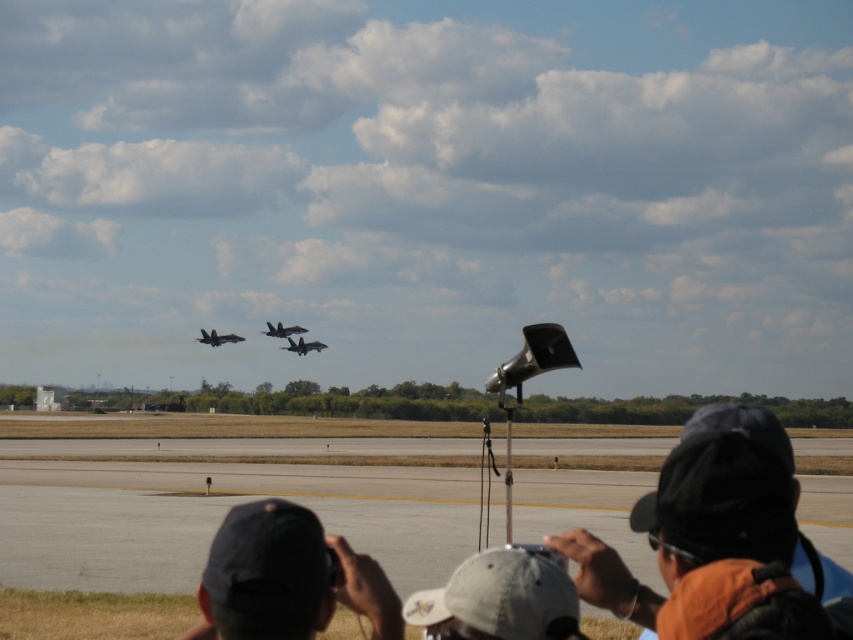
You are a photographer positioned at the lower center of the image. You notice the white fabric cap at lower center and the dark gray metallic jet at upper center. Which object appears larger in your view?

The dark gray metallic jet at upper center appears larger than the white fabric cap at lower center.

You are a photographer standing at the edge of the runway. You notice two caps in the scene. Which cap, the dark gray cap at lower right or the white fabric cap at lower center, is positioned higher up from the ground?

The dark gray cap at lower right is located above the white fabric cap at lower center, so it is positioned higher up from the ground.